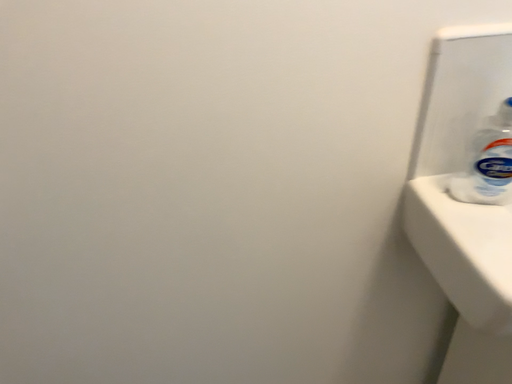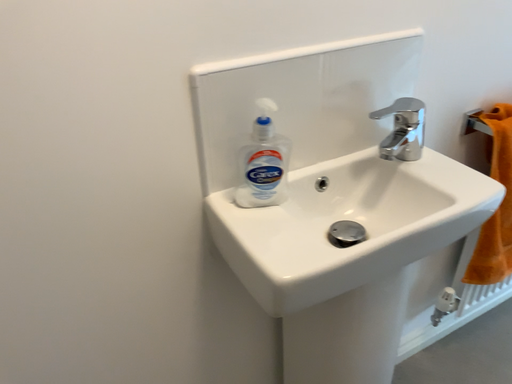
Question: Which way did the camera rotate in the video?

Choices:
 (A) rotated left
 (B) rotated right

Answer: (B)